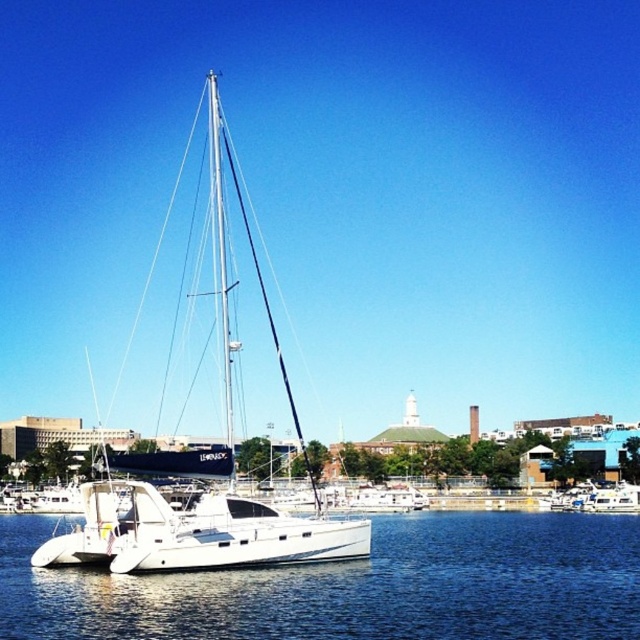
You are a photographer planning to capture the white glossy sailboat at center and the clear blue water at center in a single shot. Based on their heights, which one will appear taller in the photo?

The white glossy sailboat at center appears taller than the clear blue water at center in the photo because the sailboat has a greater height according to the description.

You are a tour guide explaining the marina layout to visitors. You mention the clear blue water at center and the white glossy sailboat at center. How far apart are these two features?

The distance between the clear blue water at center and the white glossy sailboat at center is 140.89 feet.

You are standing on the dock and see the clear blue water at center and the white glossy sailboat at center. Which object is positioned to the right of the other?

The clear blue water at center is to the right of the white glossy sailboat at center according to the description.